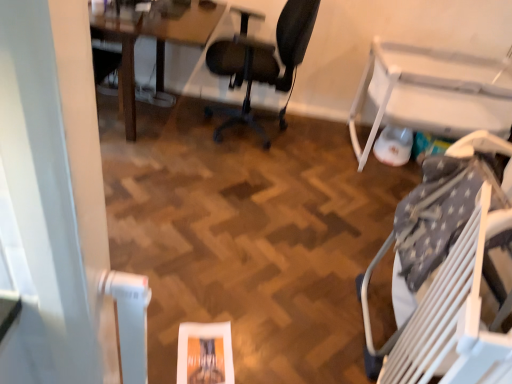
The height and width of the screenshot is (384, 512). In order to click on free space in front of wooden table at upper left, placed as the first table when sorted from left to right in this screenshot , I will do `click(161, 168)`.